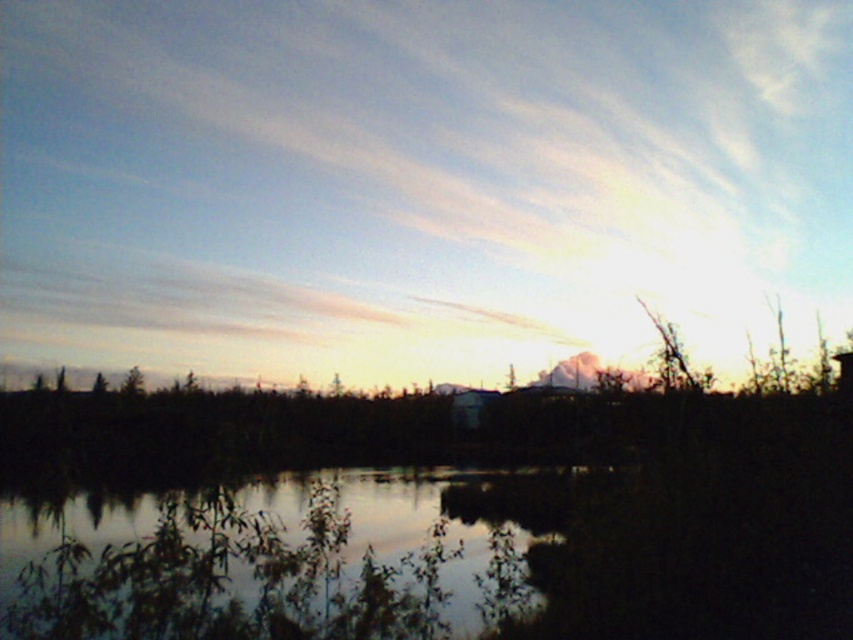
Is white fluffy cloud at upper center to the right of silvery reflective water at center from the viewer's perspective?

No, white fluffy cloud at upper center is not to the right of silvery reflective water at center.

Does white fluffy cloud at upper center appear on the left side of silvery reflective water at center?

Correct, you'll find white fluffy cloud at upper center to the left of silvery reflective water at center.

Between point (80, 8) and point (114, 513), which one is positioned behind?

The point (80, 8) is more distant.

I want to click on white fluffy cloud at upper center, so click(x=416, y=179).